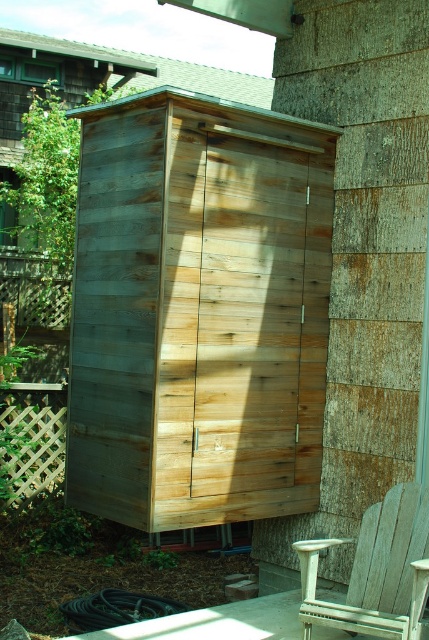
You are standing in the backyard and want to hang a bird feeder. The bird feeder requires a hook that can be placed higher than the weathered wood shed at center. Is the green wood tree at upper left tall enough to accommodate this?

The weathered wood shed at center is much taller than the green wood tree at upper left. Therefore, the green wood tree at upper left is not tall enough to place the bird feeder higher than the weathered wood shed at center.

Looking at this image, you are standing in the backyard and see the green wood tree at upper left and the white weathered wood chair at lower right. Which object is taller?

The white weathered wood chair at lower right is taller than the green wood tree at upper left.

Where is the weathered wood shed at center located in the image?

The weathered wood shed at center is located at point (198, 310).